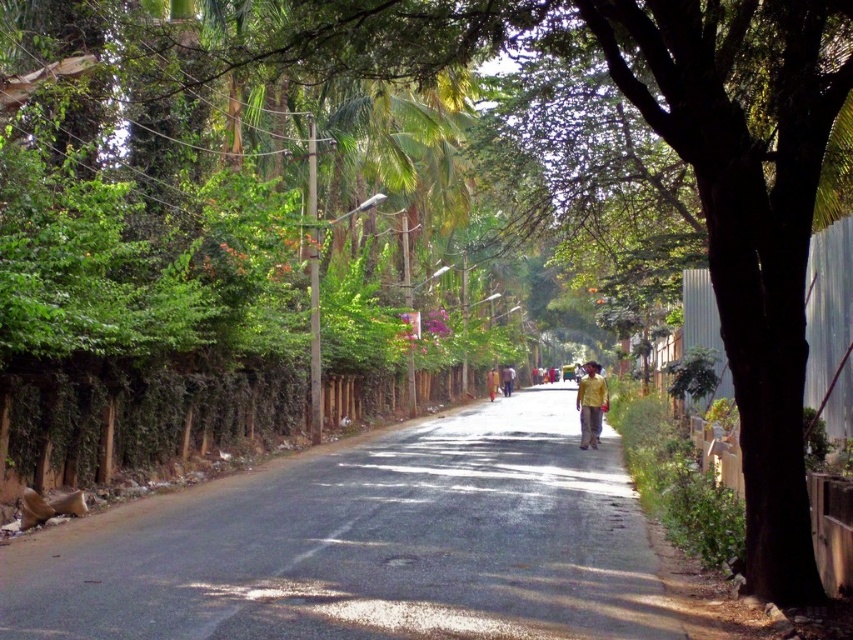
Question: Which object is closer to the camera taking this photo?

Choices:
 (A) yellow fabric shirt at center
 (B) yellow fabric at center
 (C) yellow fabric person at center
 (D) asphalt road at center

Answer: (D)

Question: Estimate the real-world distances between objects in this image. Which object is farther from the yellow fabric person at center?

Choices:
 (A) yellow fabric at center
 (B) yellow fabric shirt at center

Answer: (B)

Question: Is asphalt road at center positioned at the back of yellow fabric at center?

Choices:
 (A) no
 (B) yes

Answer: (A)

Question: Observing the image, what is the correct spatial positioning of asphalt road at center in reference to yellow fabric at center?

Choices:
 (A) below
 (B) above

Answer: (B)

Question: Considering the relative positions of yellow fabric shirt at center and yellow fabric at center in the image provided, where is yellow fabric shirt at center located with respect to yellow fabric at center?

Choices:
 (A) above
 (B) below

Answer: (A)

Question: Which point is farther to the camera?

Choices:
 (A) yellow fabric shirt at center
 (B) asphalt road at center

Answer: (A)